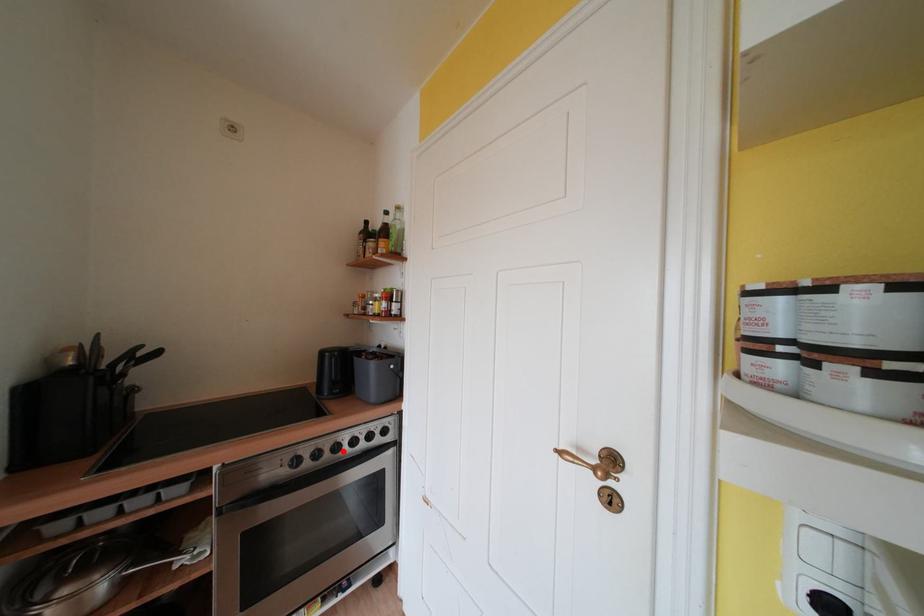
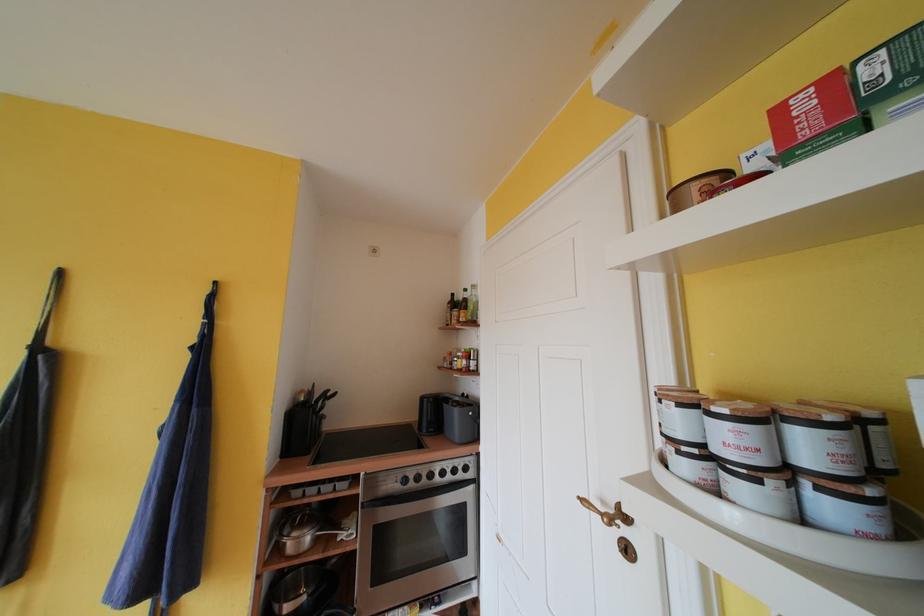
In the second image, find the point that corresponds to the highlighted location in the first image.

(436, 479)